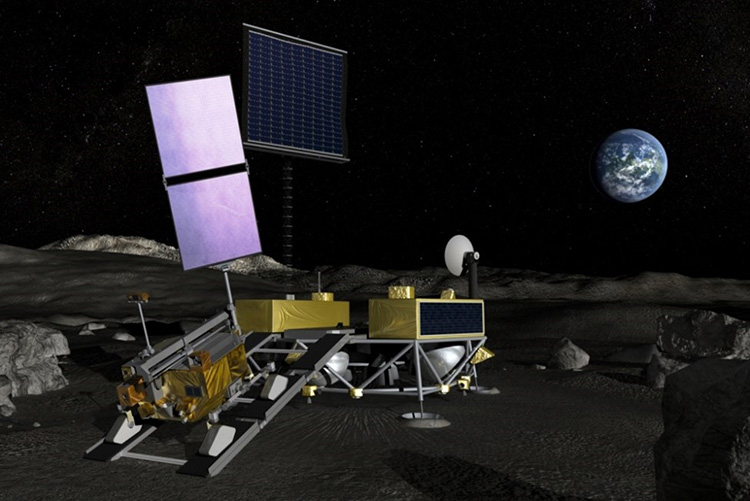
The image size is (750, 501). Find the location of `screen`. screen is located at coordinates (274, 122).